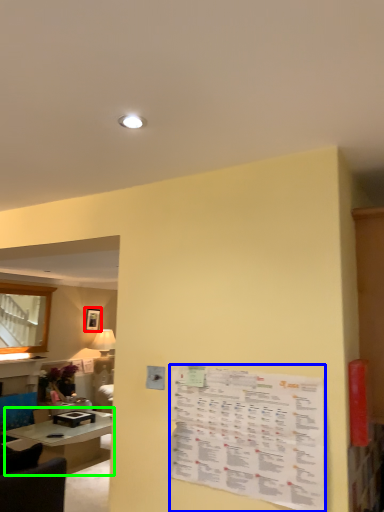
Question: Based on their relative distances, which object is nearer to picture frame (highlighted by a red box)? Choose from menu (highlighted by a blue box) and table (highlighted by a green box).

Choices:
 (A) menu
 (B) table

Answer: (B)